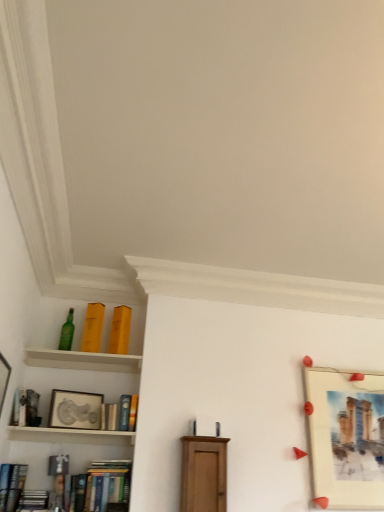
I want to click on vacant region above matte paper picture frame at right, marked as the 1th picture frame in a right-to-left arrangement (from a real-world perspective), so click(340, 370).